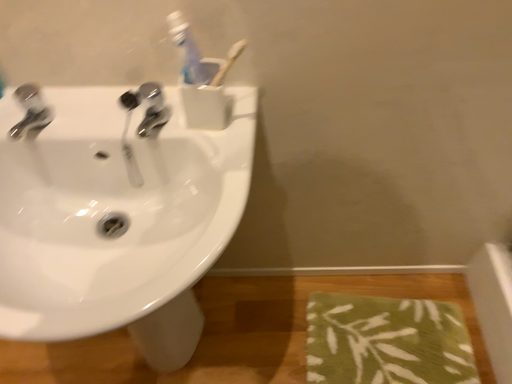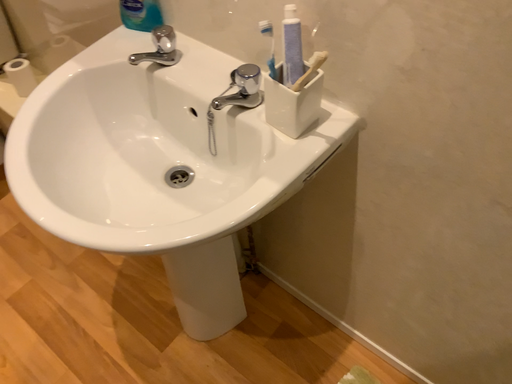
Question: Which way did the camera rotate in the video?

Choices:
 (A) rotated upward
 (B) rotated downward

Answer: (A)